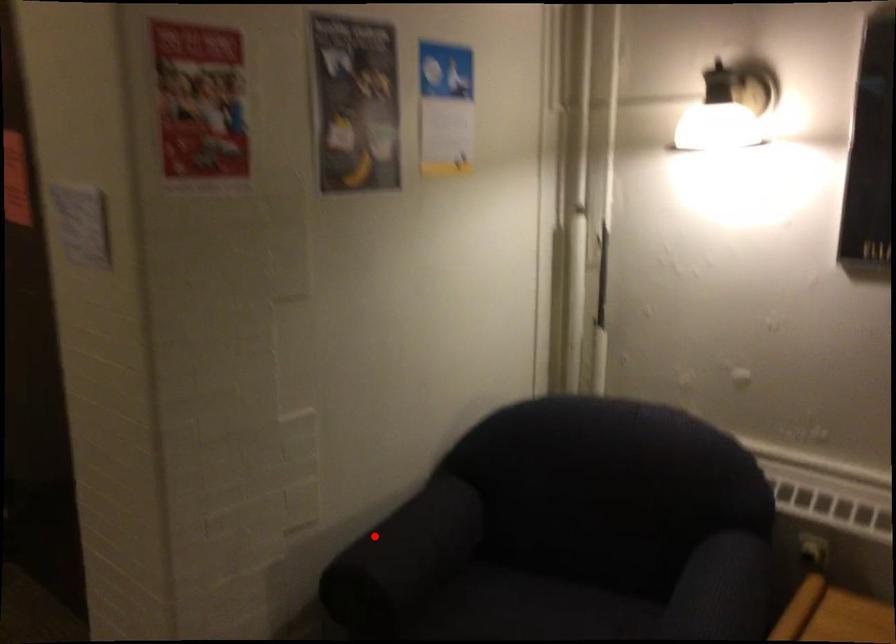
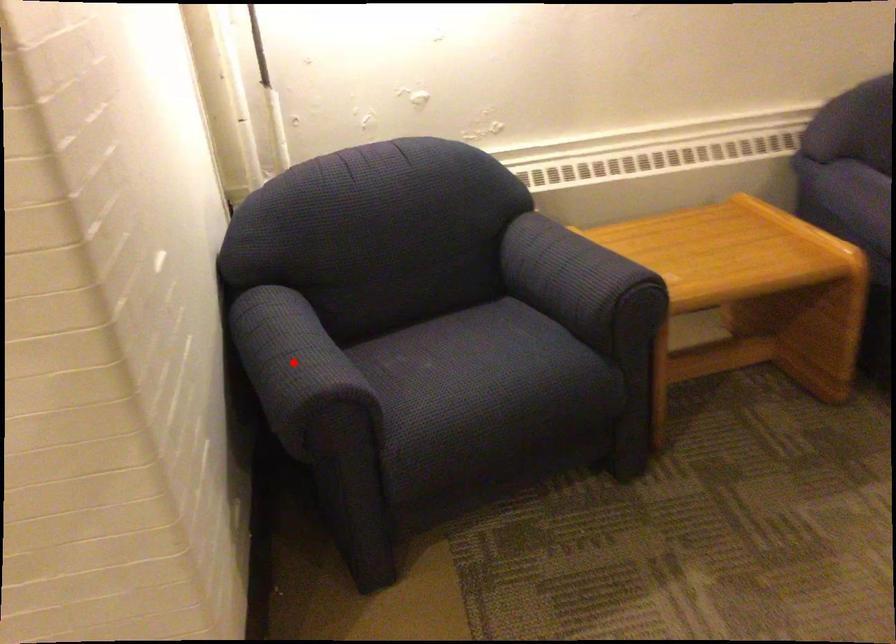
I am providing you with two images of the same scene from different viewpoints. A red point is marked on the first image and another point is marked on the second image. Do the highlighted points in image1 and image2 indicate the same real-world spot?

Yes